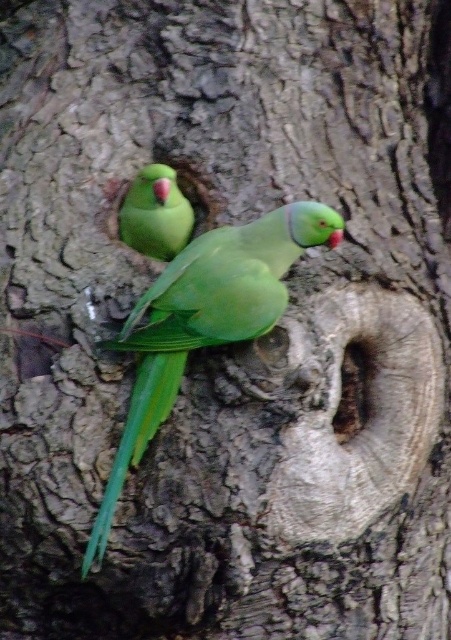
Question: Is green matte parrot at center positioned before green matte parrot at upper left?

Choices:
 (A) no
 (B) yes

Answer: (B)

Question: Which of the following is the closest to the observer?

Choices:
 (A) (171, 186)
 (B) (212, 276)

Answer: (B)

Question: Which object appears farthest from the camera in this image?

Choices:
 (A) green matte parrot at center
 (B) green matte parrot at upper left

Answer: (B)

Question: Is green matte parrot at center closer to the viewer compared to green matte parrot at upper left?

Choices:
 (A) no
 (B) yes

Answer: (B)

Question: Can you confirm if green matte parrot at center is thinner than green matte parrot at upper left?

Choices:
 (A) yes
 (B) no

Answer: (B)